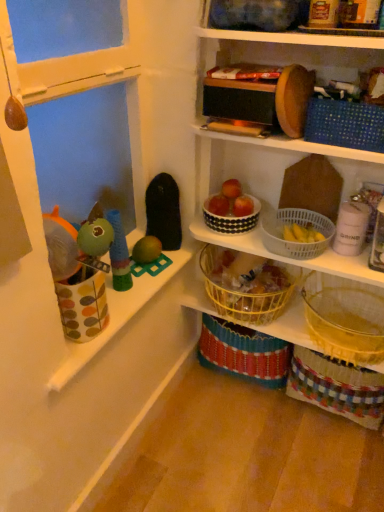
In order to click on empty space that is ontop of white dotted bowl at center, placed as the second basket when sorted from top to bottom (from a real-world perspective) in this screenshot , I will do (x=226, y=198).